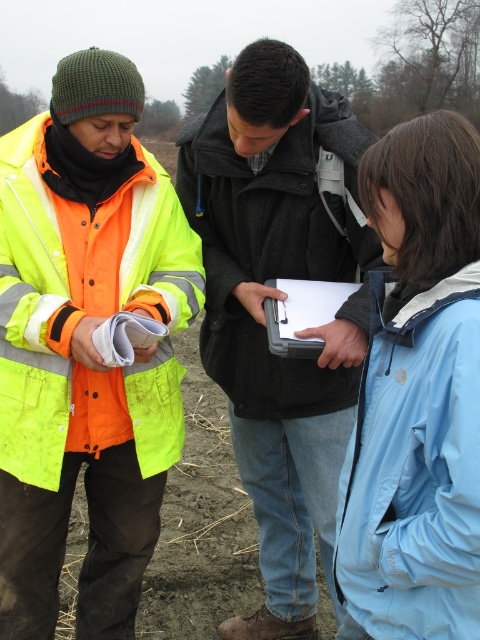
Question: Is dark gray wool jacket at center below blue softshell jacket at center?

Choices:
 (A) no
 (B) yes

Answer: (A)

Question: Is dark gray wool jacket at center further to camera compared to black plastic clipboard at center?

Choices:
 (A) yes
 (B) no

Answer: (B)

Question: Which object is positioned farthest from the blue softshell jacket at center?

Choices:
 (A) black plastic clipboard at center
 (B) neon yellow reflective jacket at left
 (C) dark gray wool jacket at center

Answer: (B)

Question: Is blue softshell jacket at center smaller than black plastic clipboard at center?

Choices:
 (A) yes
 (B) no

Answer: (B)

Question: Which of the following is the closest to the observer?

Choices:
 (A) (10, 454)
 (B) (336, 289)
 (C) (279, 74)

Answer: (C)

Question: Among these objects, which one is nearest to the camera?

Choices:
 (A) blue softshell jacket at center
 (B) black plastic clipboard at center

Answer: (A)